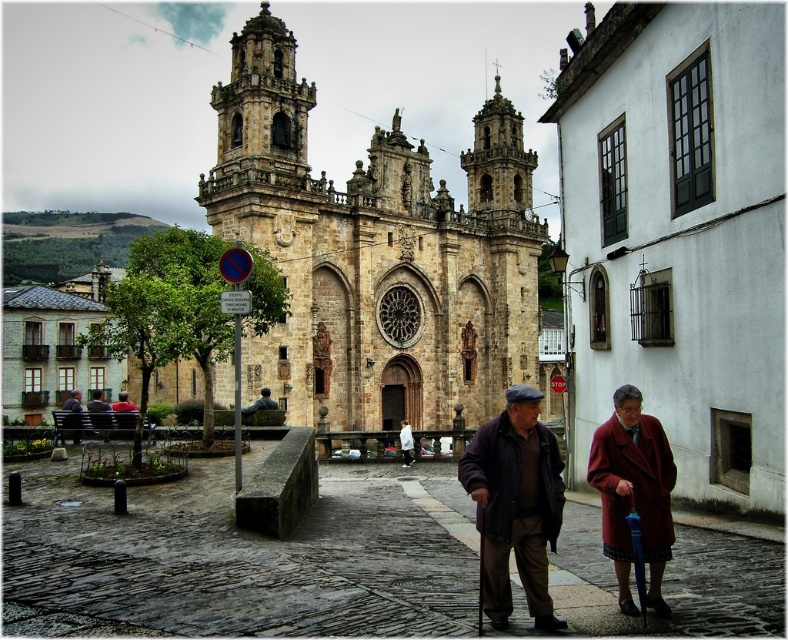
What do you see at coordinates (515, 506) in the screenshot? The width and height of the screenshot is (788, 640). I see `red wool coat at lower right` at bounding box center [515, 506].

Measure the distance between point (x=556, y=506) and camera.

The distance of point (x=556, y=506) from camera is 154.88 feet.

Which is in front, point (474, 480) or point (69, 426)?

Point (474, 480) is in front.

The height and width of the screenshot is (640, 788). I want to click on red wool coat at lower right, so click(x=515, y=506).

Which is behind, point (660, 596) or point (630, 420)?

The point (630, 420) is behind.

Is red wool coat at lower right further to the viewer compared to matte red coat at lower right?

No, it is not.

Does point (619, 424) come behind point (634, 460)?

Yes.

Where is `red wool coat at lower right`? red wool coat at lower right is located at coordinates (515, 506).

What do you see at coordinates (376, 253) in the screenshot?
I see `brown stone church at center` at bounding box center [376, 253].

At what (x,y) coordinates should I click in order to perform the action: click on brown stone church at center. Please return your answer as a coordinate pair (x, y). Image resolution: width=788 pixels, height=640 pixels. Looking at the image, I should click on (376, 253).